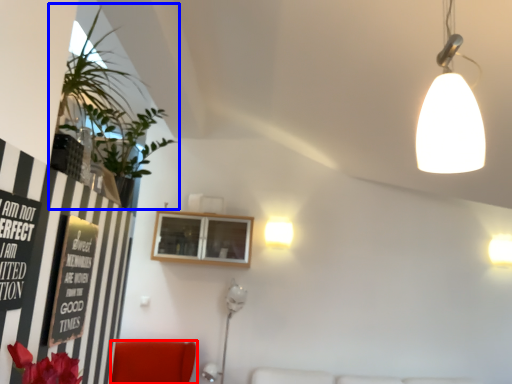
Question: Which point is closer to the camera, furniture (highlighted by a red box) or houseplant (highlighted by a blue box)?

Choices:
 (A) furniture
 (B) houseplant

Answer: (B)